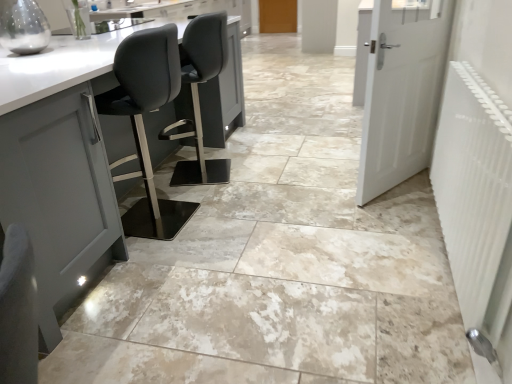
Question: Which direction should I rotate to look at wooden door at center, the 2th door positioned from the bottom?

Choices:
 (A) right
 (B) left

Answer: (A)

Question: Can you confirm if white textured radiator at right is bigger than wooden door at center, the 2th door positioned from the bottom?

Choices:
 (A) yes
 (B) no

Answer: (A)

Question: Considering the relative sizes of white textured radiator at right and wooden door at center, which is the second door from front to back, in the image provided, is white textured radiator at right taller than wooden door at center, which is the second door from front to back,?

Choices:
 (A) yes
 (B) no

Answer: (B)

Question: Is white textured radiator at right touching wooden door at center, the 2th door positioned from the bottom?

Choices:
 (A) yes
 (B) no

Answer: (B)

Question: Can you confirm if white textured radiator at right is positioned to the left of wooden door at center, the 2th door positioned from the bottom?

Choices:
 (A) yes
 (B) no

Answer: (B)

Question: Is white textured radiator at right not close to wooden door at center, which ranks as the 1th door in top-to-bottom order?

Choices:
 (A) yes
 (B) no

Answer: (A)

Question: From the image's perspective, is white textured radiator at right over wooden door at center, which ranks as the 1th door in top-to-bottom order?

Choices:
 (A) no
 (B) yes

Answer: (A)

Question: Considering the relative positions of wooden door at center, which is the 1th door in back-to-front order, and white textured radiator at right in the image provided, is wooden door at center, which is the 1th door in back-to-front order, behind white textured radiator at right?

Choices:
 (A) no
 (B) yes

Answer: (B)

Question: Are wooden door at center, which is the second door from front to back, and white textured radiator at right beside each other?

Choices:
 (A) yes
 (B) no

Answer: (B)

Question: Does wooden door at center, which ranks as the 1th door in top-to-bottom order, turn towards white textured radiator at right?

Choices:
 (A) no
 (B) yes

Answer: (B)

Question: Does wooden door at center, the 2th door positioned from the bottom, have a smaller size compared to white textured radiator at right?

Choices:
 (A) yes
 (B) no

Answer: (A)

Question: Does wooden door at center, the 2th door positioned from the bottom, come in front of white textured radiator at right?

Choices:
 (A) yes
 (B) no

Answer: (B)

Question: Considering the relative sizes of wooden door at center, the 2th door positioned from the bottom, and white textured radiator at right in the image provided, is wooden door at center, the 2th door positioned from the bottom, taller than white textured radiator at right?

Choices:
 (A) yes
 (B) no

Answer: (A)

Question: From a real-world perspective, is white matte door at right, which is the 2th door from top to bottom, on top of white textured radiator at right?

Choices:
 (A) no
 (B) yes

Answer: (B)